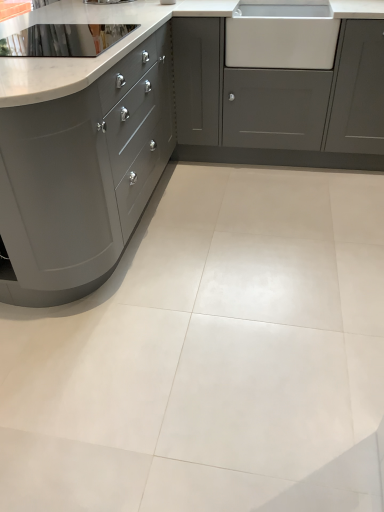
Question: In the image, is polished stainless steel sink at upper left positioned in front of or behind white glossy tile at center?

Choices:
 (A) behind
 (B) front

Answer: (A)

Question: From the image's perspective, is polished stainless steel sink at upper left positioned above or below white glossy tile at center?

Choices:
 (A) below
 (B) above

Answer: (B)

Question: Based on their relative distances, which object is nearer to the white glossy tile at center?

Choices:
 (A) matte gray cabinet at center, marked as the second cabinetry in a left-to-right arrangement
 (B) white glossy sink at upper right
 (C) matte gray cabinetry at left, marked as the first cabinetry in a left-to-right arrangement
 (D) polished stainless steel sink at upper left

Answer: (C)

Question: Based on their relative distances, which object is farther from the white glossy sink at upper right?

Choices:
 (A) polished stainless steel sink at upper left
 (B) matte gray cabinet at center, the first cabinetry positioned from the right
 (C) matte gray cabinetry at left, marked as the first cabinetry in a left-to-right arrangement
 (D) white glossy tile at center

Answer: (D)